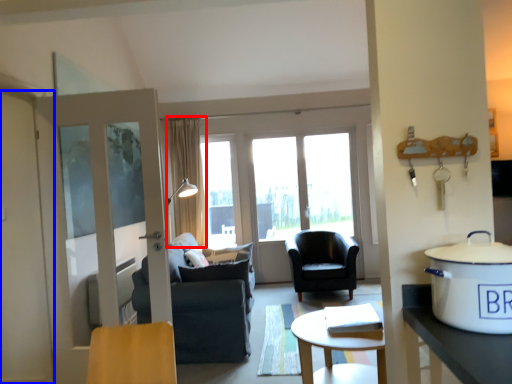
Question: Among these objects, which one is farthest to the camera, curtain (highlighted by a red box) or screen door (highlighted by a blue box)?

Choices:
 (A) curtain
 (B) screen door

Answer: (A)